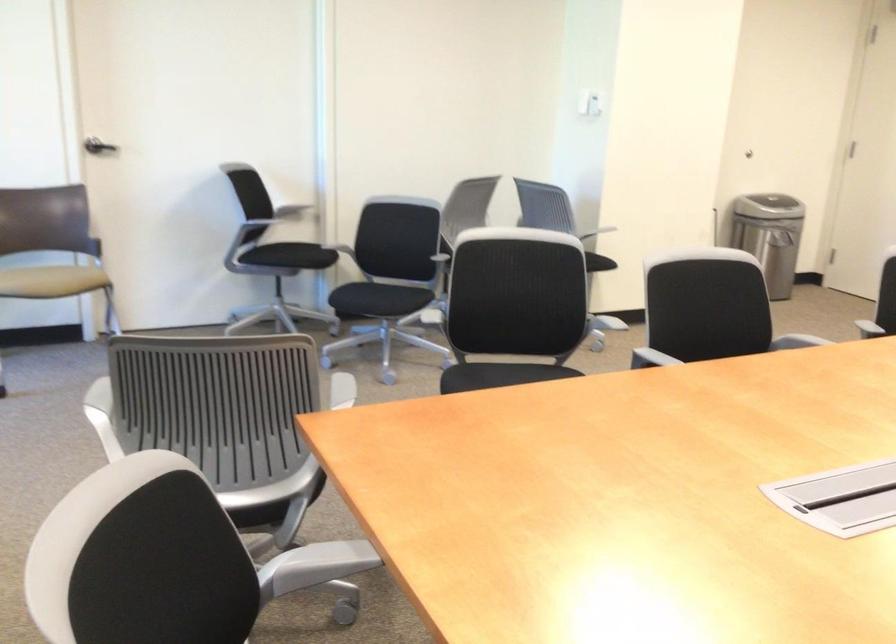
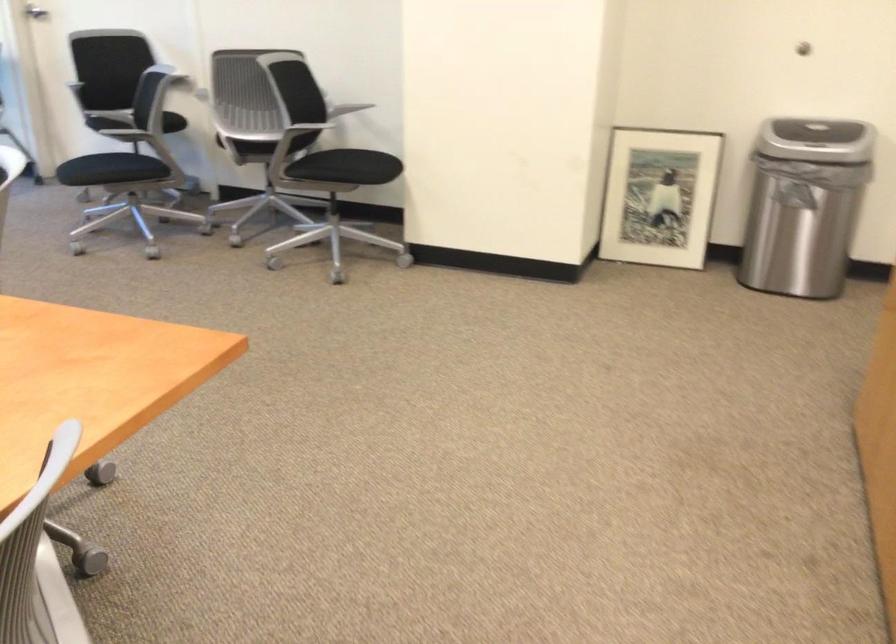
Question: I am providing you with two images of the same scene from different viewpoints. Please identify which objects are invisible in image2.

Choices:
 (A) green plastic box
 (B) trash can lid
 (C) silver door handle
 (D) chair armrest

Answer: (D)